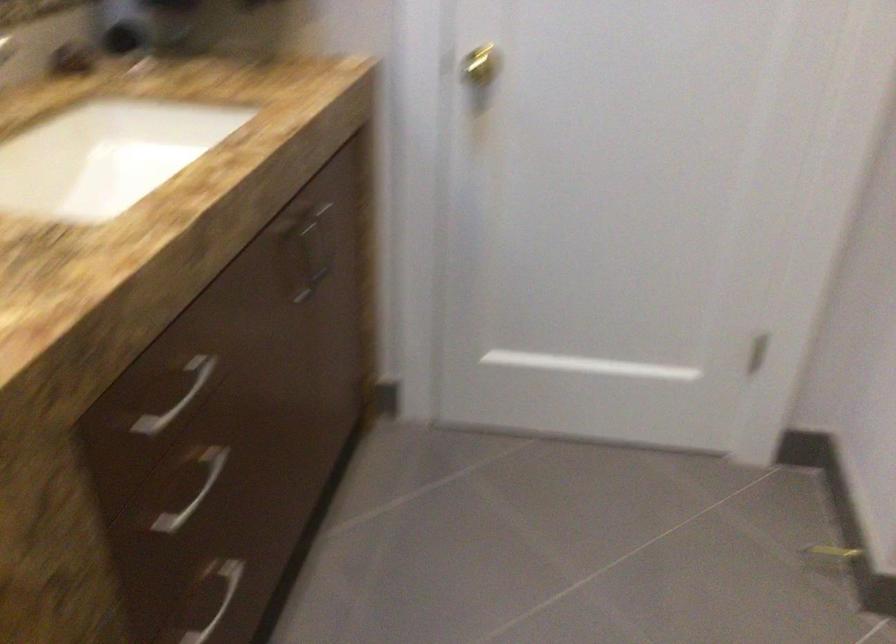
The width and height of the screenshot is (896, 644). Identify the location of gold doorknob. (480, 64).